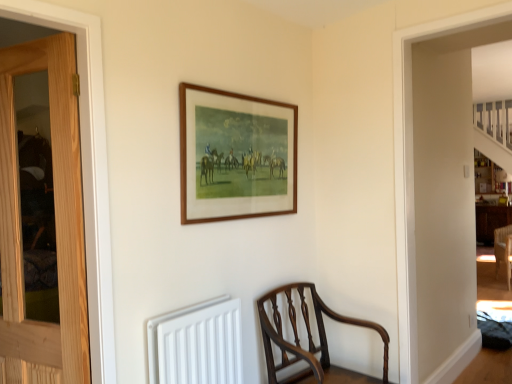
Describe the element at coordinates (236, 155) in the screenshot. This screenshot has width=512, height=384. I see `wooden picture frame at upper center` at that location.

Measure the distance between point (198,373) and camera.

5.66 feet.

What is the approximate height of white matte radiator at lower center?

The height of white matte radiator at lower center is 18.17 inches.

At what (x,y) coordinates should I click in order to perform the action: click on wooden picture frame at upper center. Please return your answer as a coordinate pair (x, y). This screenshot has height=384, width=512. Looking at the image, I should click on [236, 155].

From the image's perspective, is white matte radiator at lower center below mahogany wood chair at lower center?

Actually, white matte radiator at lower center appears above mahogany wood chair at lower center in the image.

Is white matte radiator at lower center inside the boundaries of mahogany wood chair at lower center, or outside?

white matte radiator at lower center exists outside the volume of mahogany wood chair at lower center.

From a real-world perspective, is white matte radiator at lower center above or below mahogany wood chair at lower center?

white matte radiator at lower center is situated higher than mahogany wood chair at lower center in the real world.

Which point is more forward, (241, 368) or (76, 223)?

Positioned in front is point (76, 223).

Consider the image. From a real-world perspective, relative to light brown wood door at left, is white matte radiator at lower center vertically above or below?

white matte radiator at lower center is below light brown wood door at left.

Is white matte radiator at lower center bigger than light brown wood door at left?

No.

Which object is positioned more to the left, white matte radiator at lower center or light brown wood door at left?

From the viewer's perspective, light brown wood door at left appears more on the left side.

Based on the photo, from the image's perspective, is white matte radiator at lower center under wooden picture frame at upper center?

Correct, white matte radiator at lower center appears lower than wooden picture frame at upper center in the image.

In terms of height, does white matte radiator at lower center look taller or shorter compared to wooden picture frame at upper center?

In the image, white matte radiator at lower center appears to be shorter than wooden picture frame at upper center.

What's the angular difference between white matte radiator at lower center and wooden picture frame at upper center's facing directions?

There is a 0.829-degree angle between the facing directions of white matte radiator at lower center and wooden picture frame at upper center.

Would you say light brown wood door at left is to the left or to the right of wooden picture frame at upper center in the picture?

light brown wood door at left is positioned on wooden picture frame at upper center's left side.

Considering the sizes of light brown wood door at left and wooden picture frame at upper center in the image, is light brown wood door at left bigger or smaller than wooden picture frame at upper center?

Clearly, light brown wood door at left is larger in size than wooden picture frame at upper center.

From their relative heights in the image, would you say light brown wood door at left is taller or shorter than wooden picture frame at upper center?

Clearly, light brown wood door at left is taller compared to wooden picture frame at upper center.

From the image's perspective, is light brown wood door at left below wooden picture frame at upper center?

Yes, from the image's perspective, light brown wood door at left is below wooden picture frame at upper center.

Considering the relative sizes of wooden picture frame at upper center and mahogany wood chair at lower center in the image provided, is wooden picture frame at upper center taller than mahogany wood chair at lower center?

In fact, wooden picture frame at upper center may be shorter than mahogany wood chair at lower center.

Is wooden picture frame at upper center facing away from mahogany wood chair at lower center?

No, wooden picture frame at upper center is not facing away from mahogany wood chair at lower center.

Is wooden picture frame at upper center not within mahogany wood chair at lower center?

Absolutely, wooden picture frame at upper center is external to mahogany wood chair at lower center.

Is wooden picture frame at upper center bigger than mahogany wood chair at lower center?

No, wooden picture frame at upper center is not bigger than mahogany wood chair at lower center.

The height and width of the screenshot is (384, 512). In the image, there is a mahogany wood chair at lower center. Identify the location of picture frame above it (from the image's perspective). (236, 155).

In the scene shown: What's the angular difference between mahogany wood chair at lower center and wooden picture frame at upper center's facing directions?

The angular difference between mahogany wood chair at lower center and wooden picture frame at upper center is 2.41 degrees.

From a real-world perspective, who is located lower, mahogany wood chair at lower center or wooden picture frame at upper center?

mahogany wood chair at lower center is physically lower.

Is mahogany wood chair at lower center facing towards wooden picture frame at upper center?

No, mahogany wood chair at lower center does not turn towards wooden picture frame at upper center.

Which is in front, point (270, 329) or point (76, 215)?

The point (76, 215) is more forward.

Are mahogany wood chair at lower center and light brown wood door at left far apart?

That's right, there is a large distance between mahogany wood chair at lower center and light brown wood door at left.

Could you tell me if mahogany wood chair at lower center is turned towards light brown wood door at left?

No, mahogany wood chair at lower center does not turn towards light brown wood door at left.

Is light brown wood door at left located within mahogany wood chair at lower center?

Definitely not — light brown wood door at left is not inside mahogany wood chair at lower center.

Locate an element on the screen. The image size is (512, 384). radiator above the mahogany wood chair at lower center (from the image's perspective) is located at coordinates [197, 344].

I want to click on radiator below the light brown wood door at left (from the image's perspective), so click(197, 344).

When comparing their distances from white matte radiator at lower center, does mahogany wood chair at lower center or wooden picture frame at upper center seem closer?

Based on the image, mahogany wood chair at lower center appears to be nearer to white matte radiator at lower center.

Considering their positions, is mahogany wood chair at lower center positioned closer to light brown wood door at left than wooden picture frame at upper center?

Based on the image, wooden picture frame at upper center appears to be nearer to light brown wood door at left.

From the picture: Estimate the real-world distances between objects in this image. Which object is closer to white matte radiator at lower center, light brown wood door at left or mahogany wood chair at lower center?

light brown wood door at left is positioned closer to the anchor white matte radiator at lower center.

From the image, which object appears to be nearer to wooden picture frame at upper center, light brown wood door at left or mahogany wood chair at lower center?

The object closer to wooden picture frame at upper center is light brown wood door at left.

Based on their spatial positions, is light brown wood door at left or wooden picture frame at upper center closer to mahogany wood chair at lower center?

wooden picture frame at upper center is positioned closer to the anchor mahogany wood chair at lower center.

From the image, which object appears to be farther from light brown wood door at left, wooden picture frame at upper center or mahogany wood chair at lower center?

mahogany wood chair at lower center lies further to light brown wood door at left than the other object.

Considering their positions, is white matte radiator at lower center positioned further to mahogany wood chair at lower center than light brown wood door at left?

Among the two, light brown wood door at left is located further to mahogany wood chair at lower center.

When comparing their distances from mahogany wood chair at lower center, does light brown wood door at left or white matte radiator at lower center seem further?

light brown wood door at left is positioned further to the anchor mahogany wood chair at lower center.

Find the location of a particular element. radiator between light brown wood door at left and mahogany wood chair at lower center from left to right is located at coordinates (197, 344).

The height and width of the screenshot is (384, 512). I want to click on picture frame located between light brown wood door at left and mahogany wood chair at lower center in the left-right direction, so click(x=236, y=155).

Find the location of a particular element. radiator between wooden picture frame at upper center and mahogany wood chair at lower center in the up-down direction is located at coordinates (197, 344).

At what (x,y) coordinates should I click in order to perform the action: click on radiator situated between light brown wood door at left and wooden picture frame at upper center from left to right. Please return your answer as a coordinate pair (x, y). Looking at the image, I should click on (197, 344).